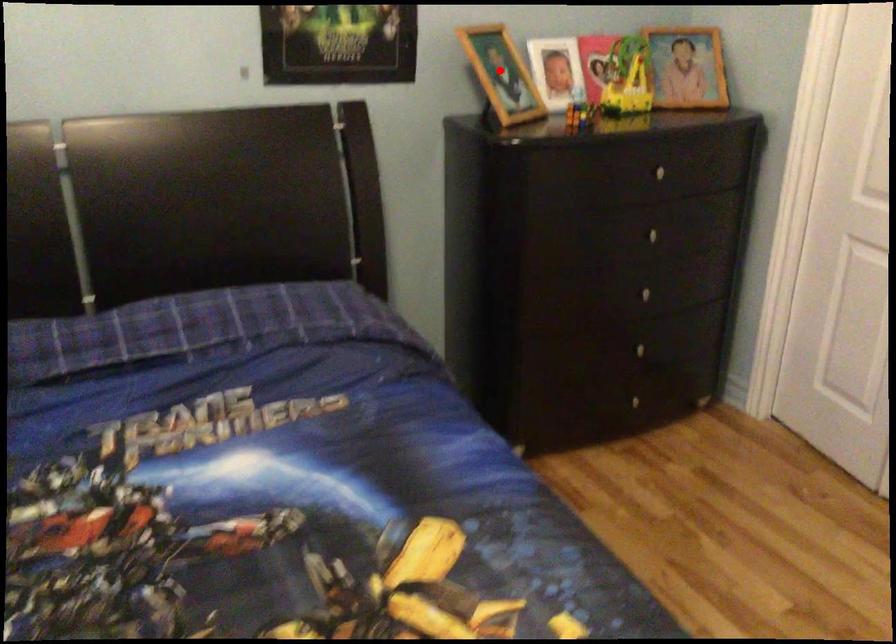
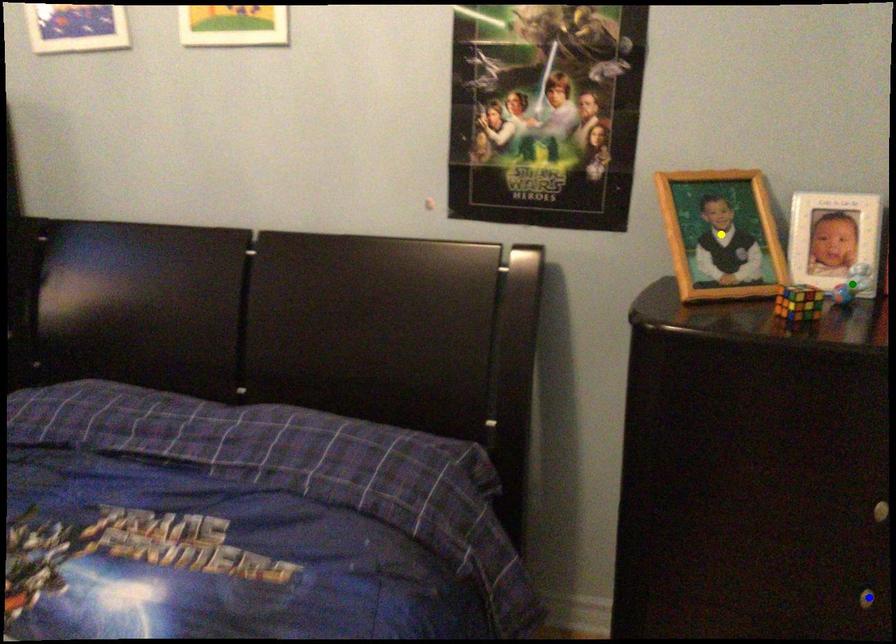
Question: I am providing you with two images of the same scene from different viewpoints. A red point is marked on the first image. You are given multiple points on the second image. Which point in image 2 represents the same 3d spot as the red point in image 1?

Choices:
 (A) blue point
 (B) yellow point
 (C) green point

Answer: (B)